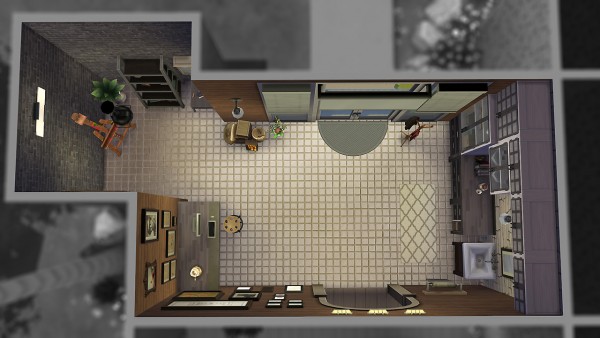
Identify the location of counter. Image resolution: width=600 pixels, height=338 pixels. (481, 198).